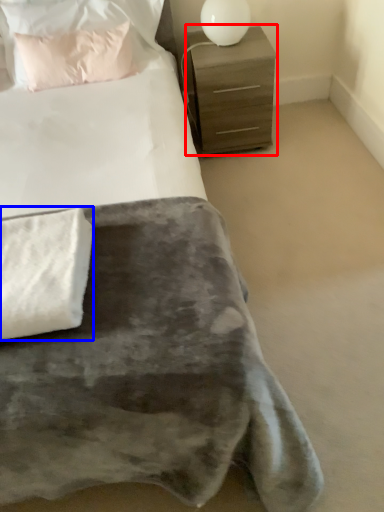
Question: Among these objects, which one is nearest to the camera, chest of drawers (highlighted by a red box) or blanket (highlighted by a blue box)?

Choices:
 (A) chest of drawers
 (B) blanket

Answer: (B)